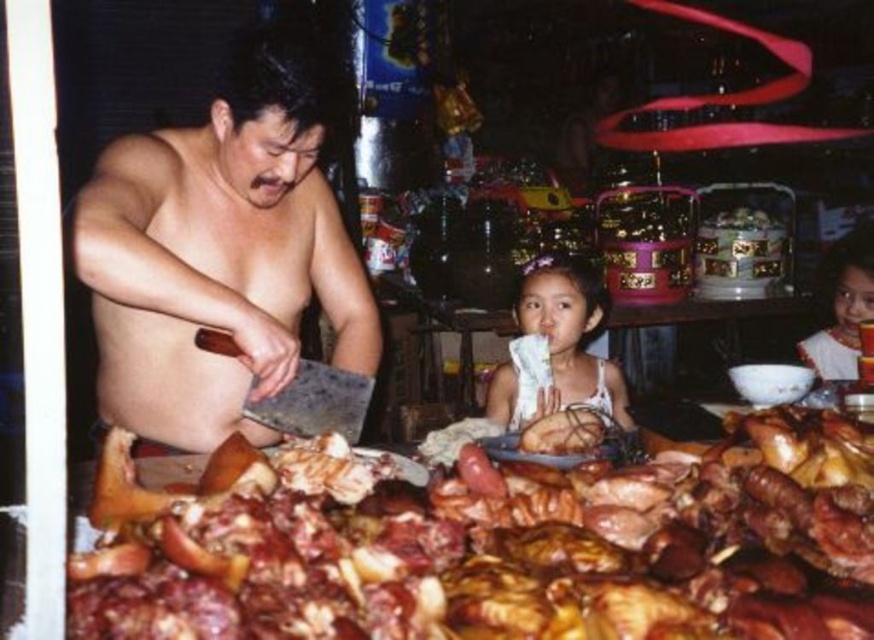
Question: Which point is farther to the camera?

Choices:
 (A) (203, 230)
 (B) (857, 337)
 (C) (323, 570)

Answer: (B)

Question: Is matte white dress at center below brown glossy roasted meat at center?

Choices:
 (A) no
 (B) yes

Answer: (A)

Question: Which point is closer to the camera taking this photo?

Choices:
 (A) (200, 445)
 (B) (581, 432)

Answer: (B)

Question: From the image, what is the correct spatial relationship of white lace dress at center in relation to wooden table at center?

Choices:
 (A) right
 (B) left

Answer: (A)

Question: Does white lace dress at center have a larger size compared to matte white dress at center?

Choices:
 (A) no
 (B) yes

Answer: (B)

Question: Which point is farther from the camera taking this photo?

Choices:
 (A) (866, 275)
 (B) (267, 496)
 (C) (463, 333)
 (D) (588, 392)

Answer: (C)